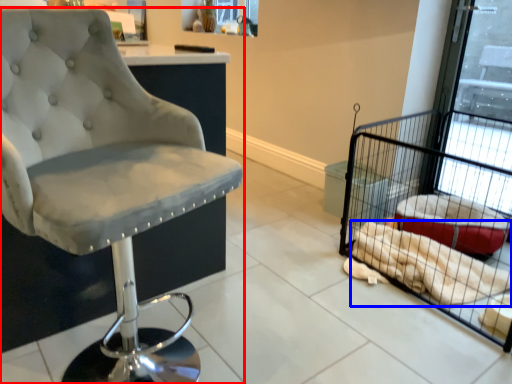
Question: Which object is closer to the camera taking this photo, chair (highlighted by a red box) or material (highlighted by a blue box)?

Choices:
 (A) chair
 (B) material

Answer: (A)